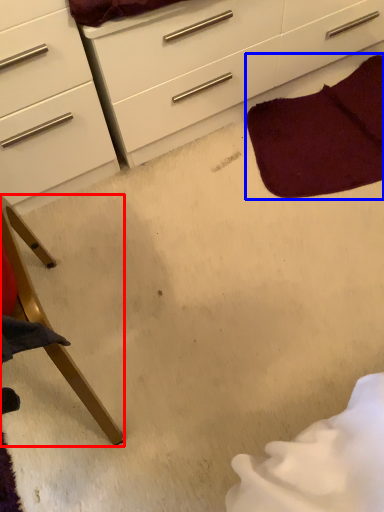
Question: Which object is closer to the camera taking this photo, furniture (highlighted by a red box) or blanket (highlighted by a blue box)?

Choices:
 (A) furniture
 (B) blanket

Answer: (A)